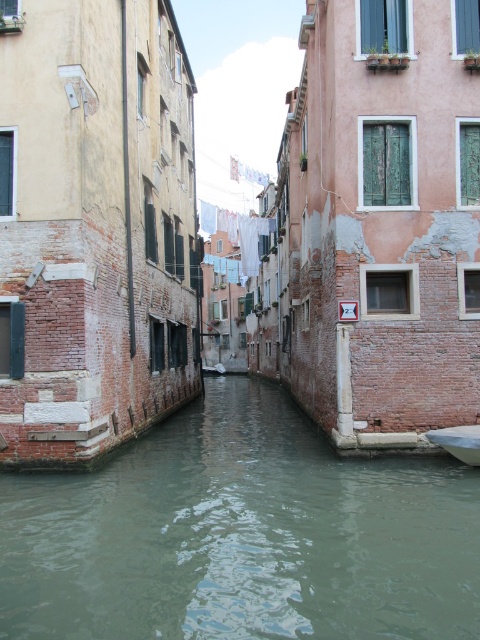
Question: Does greenish water at center lie behind white glossy boat at lower right?

Choices:
 (A) yes
 (B) no

Answer: (B)

Question: Observing the image, what is the correct spatial positioning of greenish water at center in reference to white glossy boat at lower right?

Choices:
 (A) right
 (B) left

Answer: (B)

Question: Which of the following is the farthest from the observer?

Choices:
 (A) (467, 445)
 (B) (325, 632)

Answer: (A)

Question: Can you confirm if greenish water at center is bigger than white glossy boat at lower right?

Choices:
 (A) yes
 (B) no

Answer: (A)